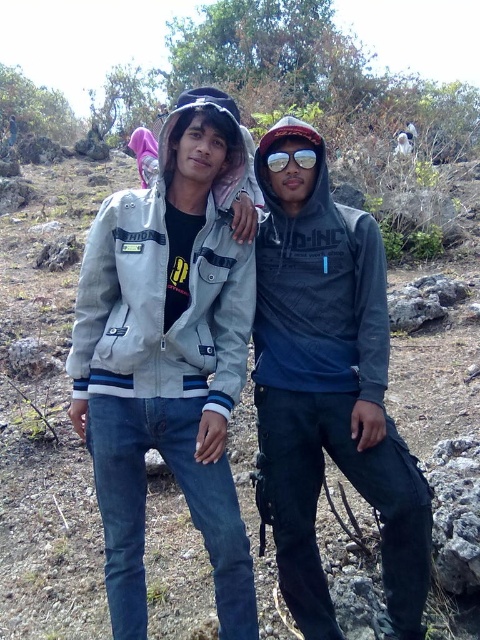
Question: Which point is closer to the camera?

Choices:
 (A) light gray fabric jacket at center
 (B) sunglasses at center

Answer: (A)

Question: Can you confirm if light gray fabric jacket at center is positioned below sunglasses at center?

Choices:
 (A) no
 (B) yes

Answer: (B)

Question: Among these objects, which one is farthest from the camera?

Choices:
 (A) sunglasses at center
 (B) light gray fabric jacket at center

Answer: (A)

Question: Considering the relative positions of matte blue hoodie at center and sunglasses at center in the image provided, where is matte blue hoodie at center located with respect to sunglasses at center?

Choices:
 (A) right
 (B) left

Answer: (A)

Question: In this image, where is light gray fabric jacket at center located relative to sunglasses at center?

Choices:
 (A) right
 (B) left

Answer: (B)

Question: Which point is closer to the camera?

Choices:
 (A) matte blue hoodie at center
 (B) sunglasses at center
 (C) light gray fabric jacket at center

Answer: (C)